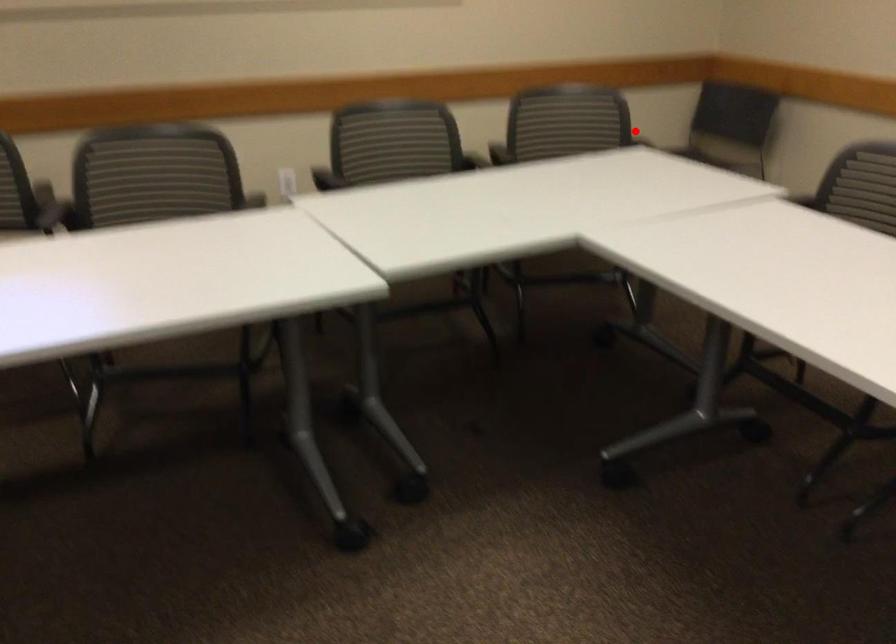
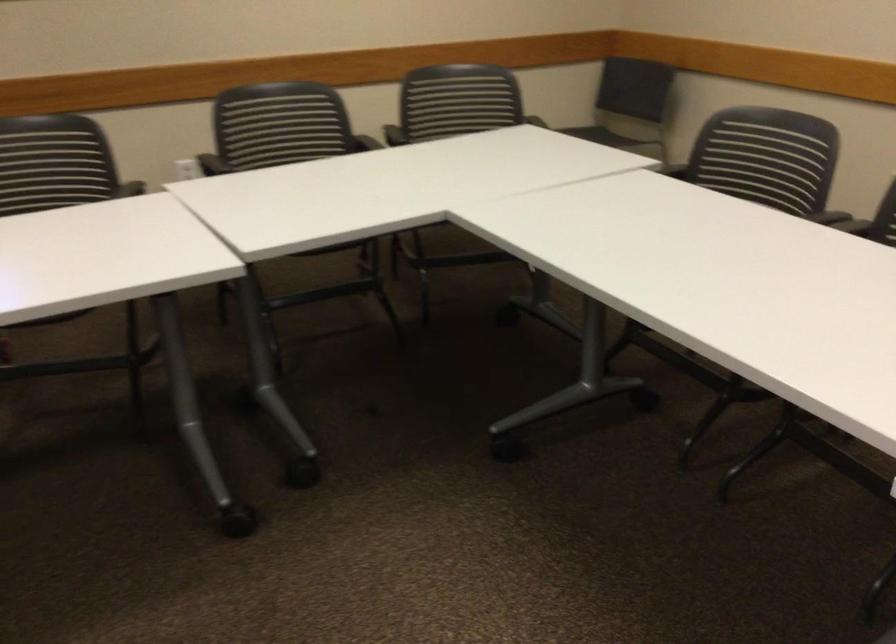
Locate, in the second image, the point that corresponds to the highlighted location in the first image.

(529, 113)